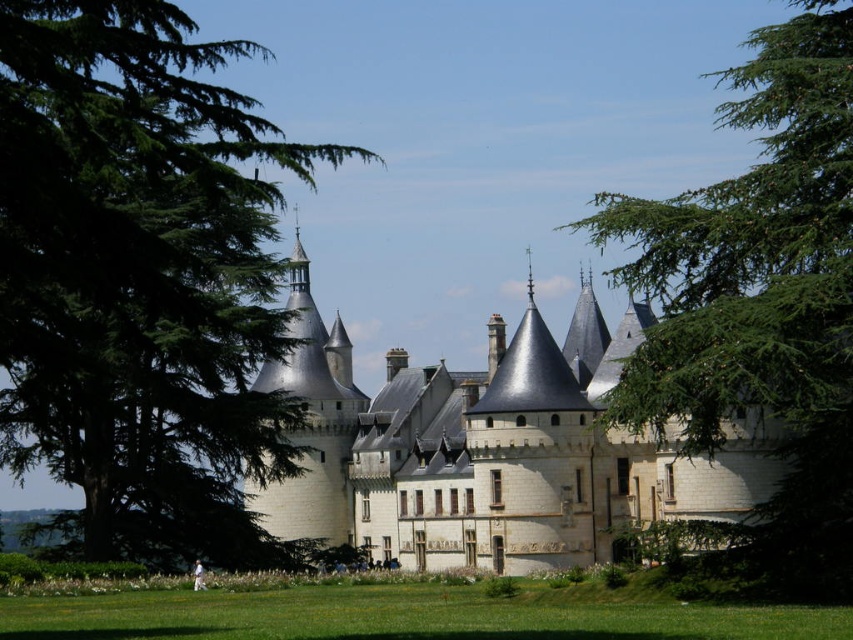
You are standing in front of the castle and notice two plants in the foreground. The first is a green leafy tree at left, and the second is green textured leaves at center. Which of these two plants is located to the left of the other?

The green leafy tree at left is positioned on the left side of green textured leaves at center.

You are standing in front of the castle and want to take a photo that includes the green leafy tree at left. Where should you position yourself relative to the castle to ensure the tree is in the frame?

To include the green leafy tree at left in your photo, position yourself to the left side of the castle since the tree is located at the left edge of the scene.

Based on the photo, you are a visitor standing in front of the castle and notice two plants in the foreground. The green leafy tree at left and the green textured leaves at center. Which one is closer to the base of the castle?

The green leafy tree at left is positioned under green textured leaves at center, meaning it is closer to the base of the castle.